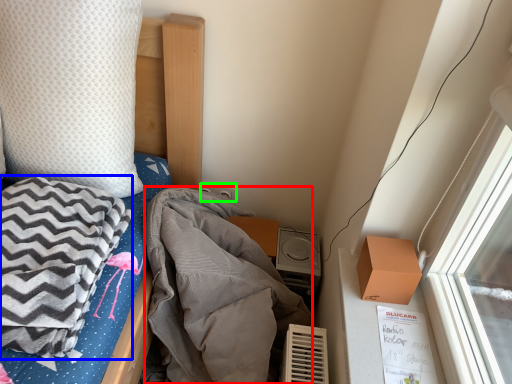
Question: Considering the real-world distances, which object is closest to blanket (highlighted by a red box)? blanket (highlighted by a blue box) or power plugs and sockets (highlighted by a green box).

Choices:
 (A) blanket
 (B) power plugs and sockets

Answer: (A)